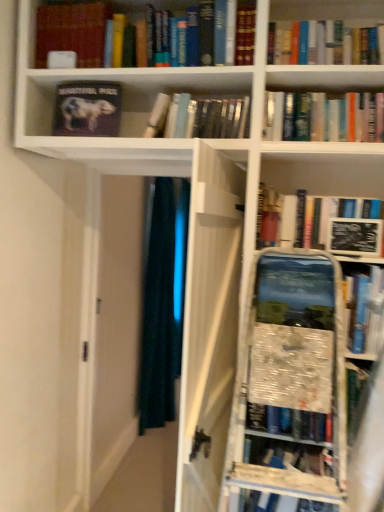
Question: Is hardcover book at center, which appears as the 2th book when viewed from the right, with matte black book at upper left, acting as the third book starting from the right?

Choices:
 (A) no
 (B) yes

Answer: (A)

Question: From the image's perspective, is hardcover book at center, which appears as the 2th book when viewed from the right, below matte black book at upper left, acting as the third book starting from the right?

Choices:
 (A) no
 (B) yes

Answer: (B)

Question: Does hardcover book at center, the 3th book from the left, have a lesser width compared to matte black book at upper left, the 2th book positioned from the left?

Choices:
 (A) no
 (B) yes

Answer: (A)

Question: Is hardcover book at center, the 3th book from the left, smaller than matte black book at upper left, the 2th book positioned from the left?

Choices:
 (A) no
 (B) yes

Answer: (A)

Question: Is hardcover book at center, the 3th book from the left, aimed at matte black book at upper left, acting as the third book starting from the right?

Choices:
 (A) no
 (B) yes

Answer: (A)

Question: Is hardcover book at center, the 3th book from the left, looking in the opposite direction of matte black book at upper left, the 2th book positioned from the left?

Choices:
 (A) no
 (B) yes

Answer: (A)

Question: Can you confirm if matte black book at upper left, acting as the third book starting from the right, is positioned to the right of hardcover book at center, the 3th book from the left?

Choices:
 (A) no
 (B) yes

Answer: (A)

Question: Is matte black book at upper left, the 2th book positioned from the left, not within hardcover book at center, the 3th book from the left?

Choices:
 (A) yes
 (B) no

Answer: (A)

Question: From the image's perspective, would you say matte black book at upper left, the 2th book positioned from the left, is positioned over hardcover book at center, which appears as the 2th book when viewed from the right?

Choices:
 (A) no
 (B) yes

Answer: (B)

Question: Is matte black book at upper left, the 2th book positioned from the left, far from hardcover book at center, which appears as the 2th book when viewed from the right?

Choices:
 (A) no
 (B) yes

Answer: (A)

Question: Can you confirm if matte black book at upper left, the 2th book positioned from the left, is shorter than hardcover book at center, which appears as the 2th book when viewed from the right?

Choices:
 (A) no
 (B) yes

Answer: (A)

Question: Is the position of matte black book at upper left, the 2th book positioned from the left, less distant than that of hardcover book at center, which appears as the 2th book when viewed from the right?

Choices:
 (A) no
 (B) yes

Answer: (A)

Question: Does matte black book at upper left, the 2th book positioned from the left, come behind hardcover book at upper center, which is counted as the 1th book, starting from the right?

Choices:
 (A) yes
 (B) no

Answer: (A)